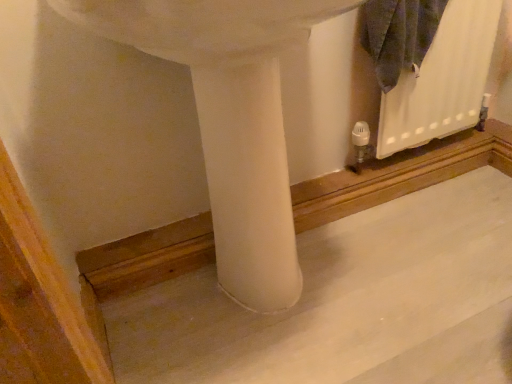
Question: Is white matte sink at center closer to camera compared to smooth concrete at center?

Choices:
 (A) no
 (B) yes

Answer: (B)

Question: Is white matte sink at center not close to smooth concrete at center?

Choices:
 (A) yes
 (B) no

Answer: (B)

Question: Does white matte sink at center appear on the left side of smooth concrete at center?

Choices:
 (A) yes
 (B) no

Answer: (A)

Question: Is white matte sink at center wider than smooth concrete at center?

Choices:
 (A) yes
 (B) no

Answer: (B)

Question: From a real-world perspective, is white matte sink at center located beneath smooth concrete at center?

Choices:
 (A) no
 (B) yes

Answer: (A)

Question: Is white matte sink at center taller than smooth concrete at center?

Choices:
 (A) no
 (B) yes

Answer: (B)

Question: From the image's perspective, does white matte radiator at upper right appear lower than smooth concrete at center?

Choices:
 (A) no
 (B) yes

Answer: (A)

Question: Can we say white matte radiator at upper right lies outside smooth concrete at center?

Choices:
 (A) yes
 (B) no

Answer: (A)

Question: Considering the relative sizes of white matte radiator at upper right and smooth concrete at center in the image provided, is white matte radiator at upper right smaller than smooth concrete at center?

Choices:
 (A) yes
 (B) no

Answer: (A)

Question: Would you consider white matte radiator at upper right to be distant from smooth concrete at center?

Choices:
 (A) no
 (B) yes

Answer: (A)

Question: From a real-world perspective, is white matte radiator at upper right beneath smooth concrete at center?

Choices:
 (A) no
 (B) yes

Answer: (A)

Question: Can you confirm if white matte radiator at upper right is positioned to the left of smooth concrete at center?

Choices:
 (A) no
 (B) yes

Answer: (A)

Question: Is white matte sink at center aimed at white matte radiator at upper right?

Choices:
 (A) no
 (B) yes

Answer: (A)